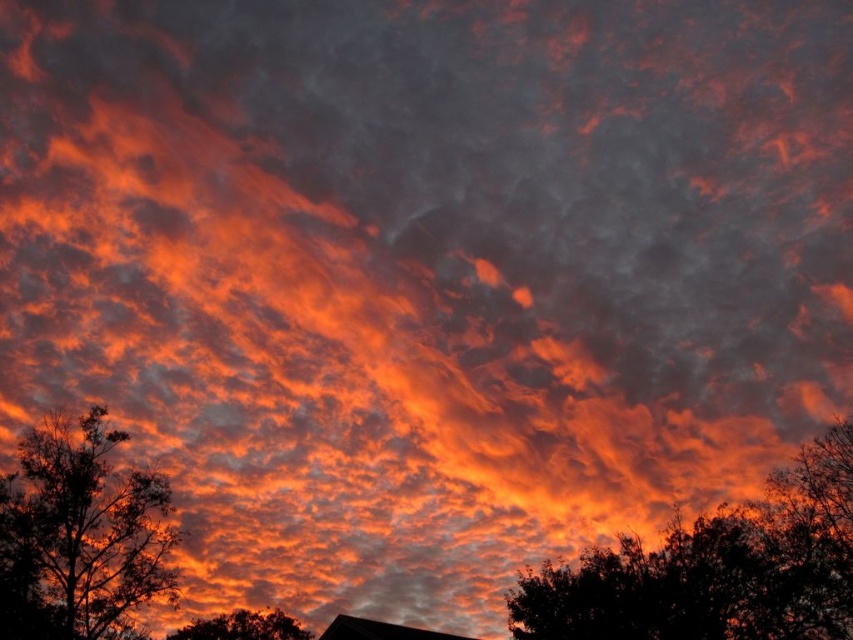
You are standing in a field looking at the sunset. You see a silhouette leafy tree at lower right and a dark green leafy tree at left. Which tree is closer to you?

The silhouette leafy tree at lower right is closer to the viewer than the dark green leafy tree at left.